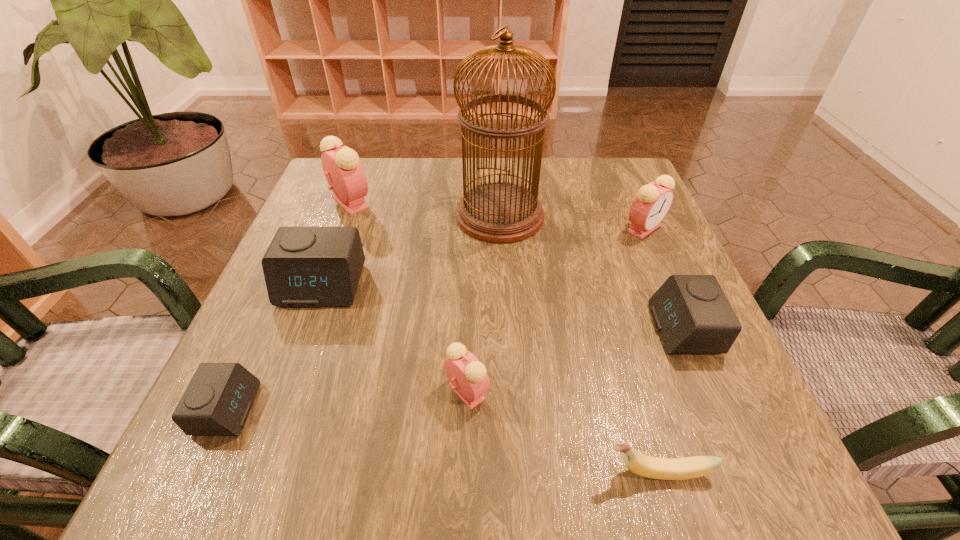
Find the location of a particular element. the tallest object is located at coordinates (499, 212).

You are a GUI agent. You are given a task and a screenshot of the screen. Output one action in this format:
    pyautogui.click(x=<x>, y=<y>)
    Task: Click on the tallest alarm clock
    This screenshot has height=540, width=960.
    Given the screenshot: What is the action you would take?
    pyautogui.click(x=344, y=173)

Identify the location of the seventh shortest object. (344, 173).

Where is `the fifth shortest alarm clock`? the fifth shortest alarm clock is located at coordinates (652, 203).

The width and height of the screenshot is (960, 540). Identify the location of the second smallest pink alarm clock. (652, 203).

The image size is (960, 540). What are the coordinates of `the biggest black alarm clock` in the screenshot? It's located at (303, 266).

This screenshot has height=540, width=960. Find the location of `the smallest pink alarm clock`. the smallest pink alarm clock is located at coordinates (469, 380).

You are a GUI agent. You are given a task and a screenshot of the screen. Output one action in this format:
    pyautogui.click(x=<x>, y=<y>)
    Task: Click on the nearest pink alarm clock
    The image size is (960, 540).
    Given the screenshot: What is the action you would take?
    pyautogui.click(x=469, y=380)

Find the location of a particular element. the second biggest black alarm clock is located at coordinates (691, 313).

This screenshot has height=540, width=960. I want to click on yellow banana, so click(x=646, y=466).